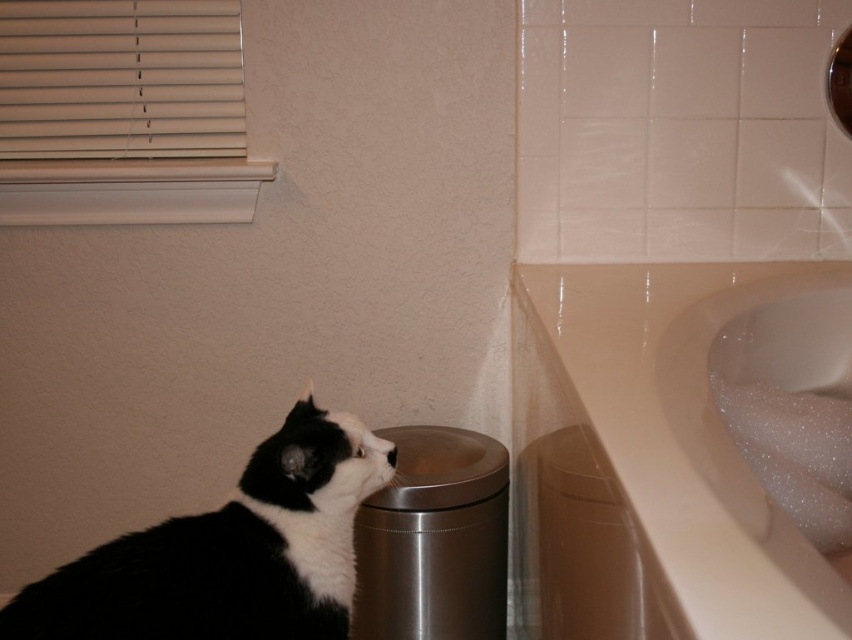
In the scene shown: You are a small toy mouse that is 10 cm long. You want to hide under the white glossy sink at upper right and the black and white fur at lower left. Which one can you fit under more comfortably?

The white glossy sink at upper right has a larger width than the black and white fur at lower left, so the toy mouse can fit under the white glossy sink at upper right more comfortably.

You are a small robot with a height of 12 inches. You need to move from the white glossy sink at upper right to the black and white fur at lower left. Can you safely pass through the space between them without hitting your head?

The distance between the white glossy sink at upper right and the black and white fur at lower left is 14.59 inches. Since your robot is 12 inches tall, you can safely pass through the space without hitting your head as the height clearance is sufficient.

You are standing in the bathroom and want to place a small plant between the two points, point (x=534, y=440) and point (x=269, y=540). Which point should you place the plant closer to so that it is in front of the other point?

You should place the plant closer to point (x=269, y=540) because point (x=534, y=440) is behind point (x=269, y=540), so placing it near the front point will ensure it is in front.